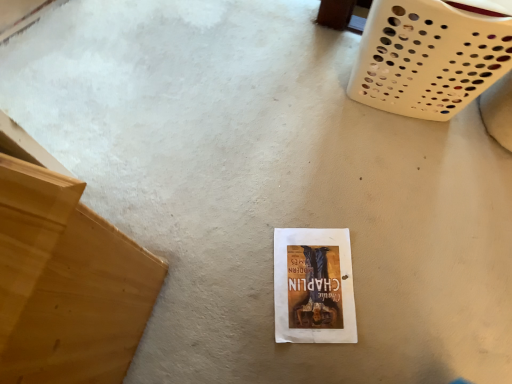
Locate an element on the screen. vacant space to the right of light brown wood at left is located at coordinates (209, 293).